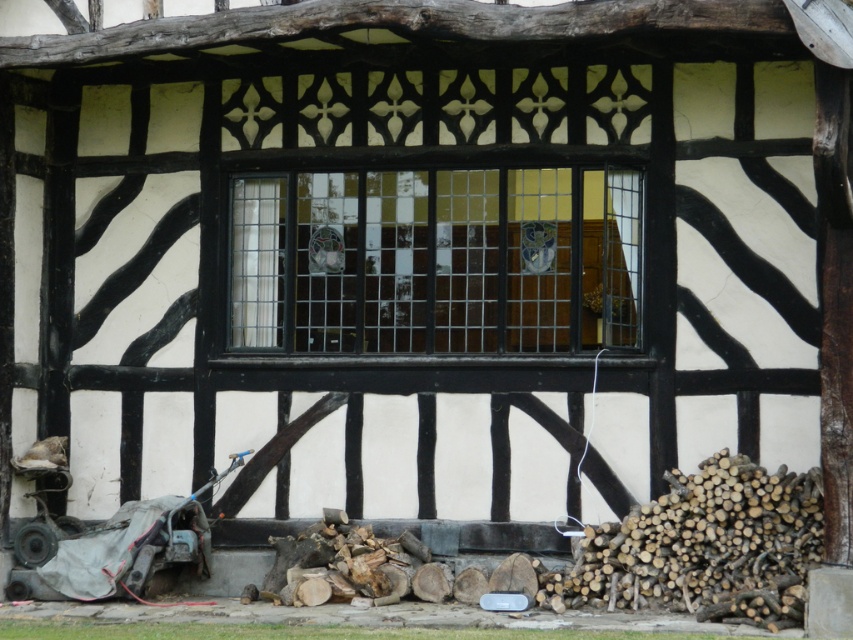
Does clear glass window at center appear under gray fabric-covered baby carriage at lower left?

No.

Is clear glass window at center taller than gray fabric-covered baby carriage at lower left?

Correct, clear glass window at center is much taller as gray fabric-covered baby carriage at lower left.

Identify the location of clear glass window at center. (436, 260).

This screenshot has width=853, height=640. Identify the location of clear glass window at center. (436, 260).